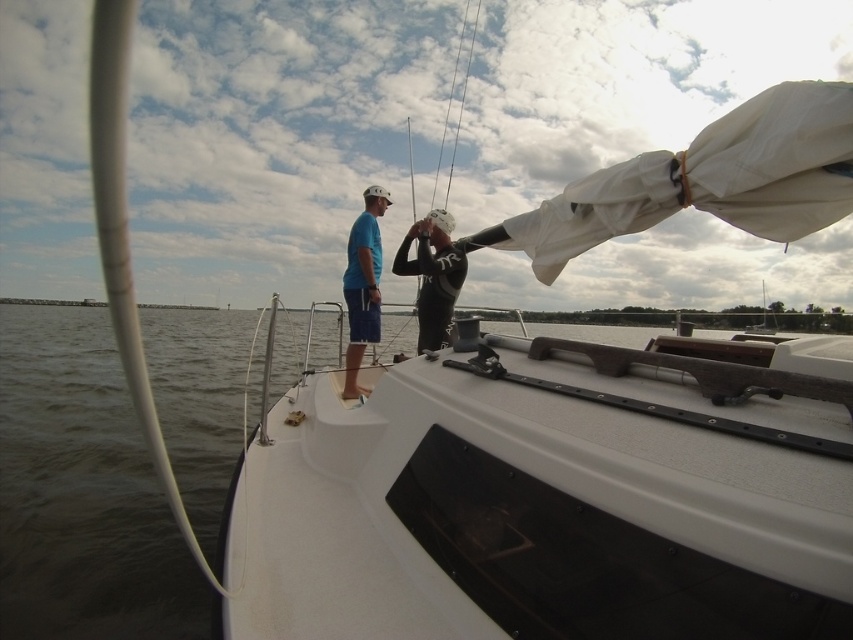
Between transparent water at center and matte blue shorts at center, which one is positioned lower?

transparent water at center

Is point (788, 458) behind point (351, 326)?

No, (788, 458) is closer to viewer.

At what (x,y) coordinates should I click in order to perform the action: click on transparent water at center. Please return your answer as a coordinate pair (x, y). This screenshot has width=853, height=640. Looking at the image, I should click on (544, 508).

Is matte blue shorts at center closer to camera compared to black rubber wetsuit at center?

That is True.

Who is shorter, matte blue shorts at center or black rubber wetsuit at center?

With less height is black rubber wetsuit at center.

Which is behind, point (341, 284) or point (465, 273)?

The point (341, 284) is more distant.

Identify the location of matte blue shorts at center. (363, 285).

Is transparent water at center closer to camera compared to black rubber wetsuit at center?

That is True.

Can you confirm if transparent water at center is positioned to the left of black rubber wetsuit at center?

Yes, transparent water at center is to the left of black rubber wetsuit at center.

The height and width of the screenshot is (640, 853). In order to click on transparent water at center in this screenshot , I will do `click(544, 508)`.